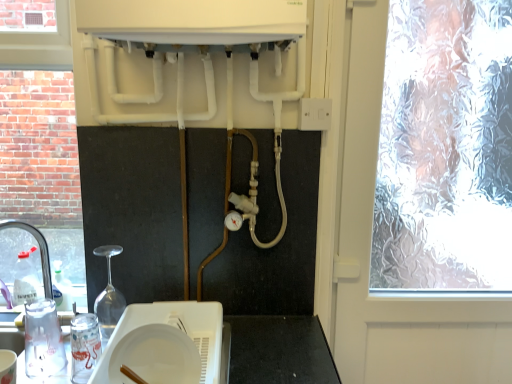
Question: Does white matte plate at center touch frosted glass window at right?

Choices:
 (A) no
 (B) yes

Answer: (A)

Question: Is white matte plate at center wider than frosted glass window at right?

Choices:
 (A) yes
 (B) no

Answer: (B)

Question: Does white matte plate at center have a smaller size compared to frosted glass window at right?

Choices:
 (A) no
 (B) yes

Answer: (B)

Question: Is white matte plate at center outside frosted glass window at right?

Choices:
 (A) yes
 (B) no

Answer: (A)

Question: Does white matte plate at center have a greater height compared to frosted glass window at right?

Choices:
 (A) yes
 (B) no

Answer: (B)

Question: Visually, is white matte plate at center positioned to the left or to the right of frosted glass window at right?

Choices:
 (A) right
 (B) left

Answer: (B)

Question: Relative to frosted glass window at right, is white matte plate at center in front or behind?

Choices:
 (A) behind
 (B) front

Answer: (B)

Question: Is point [121, 337] positioned closer to the camera than point [422, 72]?

Choices:
 (A) farther
 (B) closer

Answer: (B)

Question: In terms of height, does white matte plate at center look taller or shorter compared to frosted glass window at right?

Choices:
 (A) tall
 (B) short

Answer: (B)

Question: Considering the positions of white plastic plate at lower center, the second appliance in the left-to-right sequence, and frosted glass window at right in the image, is white plastic plate at lower center, the second appliance in the left-to-right sequence, bigger or smaller than frosted glass window at right?

Choices:
 (A) big
 (B) small

Answer: (B)

Question: In the image, is white plastic plate at lower center, arranged as the first appliance when viewed from the right, positioned in front of or behind frosted glass window at right?

Choices:
 (A) front
 (B) behind

Answer: (A)

Question: Is point (135, 306) closer or farther from the camera than point (376, 254)?

Choices:
 (A) farther
 (B) closer

Answer: (B)

Question: In terms of width, does white plastic plate at lower center, the second appliance in the left-to-right sequence, look wider or thinner when compared to frosted glass window at right?

Choices:
 (A) thin
 (B) wide

Answer: (B)

Question: From a real-world perspective, is white plastic switch at upper right positioned above or below white plastic plate at lower center, the second appliance in the left-to-right sequence?

Choices:
 (A) above
 (B) below

Answer: (A)

Question: Is white plastic switch at upper right bigger or smaller than white plastic plate at lower center, the second appliance in the left-to-right sequence?

Choices:
 (A) small
 (B) big

Answer: (A)